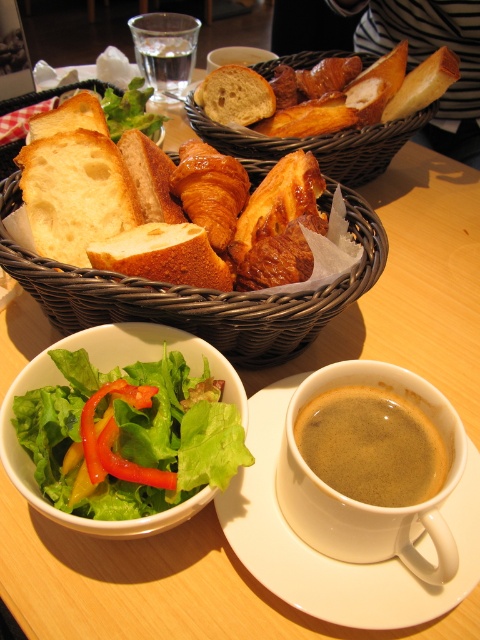
Does green leafy salad at lower left have a larger size compared to red glossy pepper at lower left?

Yes.

Does green leafy salad at lower left have a lesser width compared to red glossy pepper at lower left?

Incorrect, green leafy salad at lower left's width is not less than red glossy pepper at lower left's.

Who is more forward, (127, 454) or (91, 442)?

Positioned in front is point (91, 442).

Where is `green leafy salad at lower left`? Image resolution: width=480 pixels, height=640 pixels. green leafy salad at lower left is located at coordinates (128, 435).

Does white matte bread at center appear on the left side of golden brown crusty bread at center?

Indeed, white matte bread at center is positioned on the left side of golden brown crusty bread at center.

Does white matte bread at center appear under golden brown crusty bread at center?

Correct, white matte bread at center is located below golden brown crusty bread at center.

Does point (157, 236) come farther from viewer compared to point (195, 90)?

That is False.

You are a GUI agent. You are given a task and a screenshot of the screen. Output one action in this format:
    pyautogui.click(x=<x>, y=<y>)
    Task: Click on the white matte bread at center
    The width and height of the screenshot is (480, 640).
    Given the screenshot: What is the action you would take?
    pyautogui.click(x=164, y=256)

Is white ceramic saucer at lower center bigger than woven brown basket at center?

No.

Is point (240, 545) positioned before point (170, 296)?

Yes, it is.

Locate an element on the screen. white ceramic saucer at lower center is located at coordinates (324, 554).